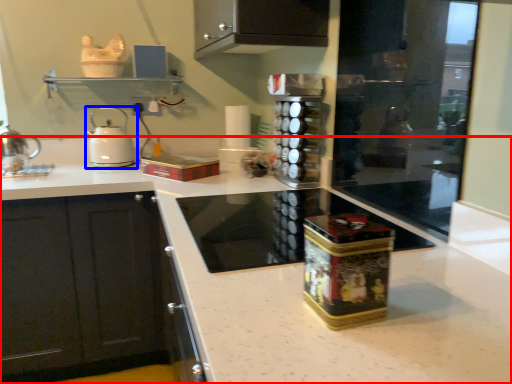
Question: Which object is further to the camera taking this photo, countertop (highlighted by a red box) or kitchen appliance (highlighted by a blue box)?

Choices:
 (A) countertop
 (B) kitchen appliance

Answer: (B)